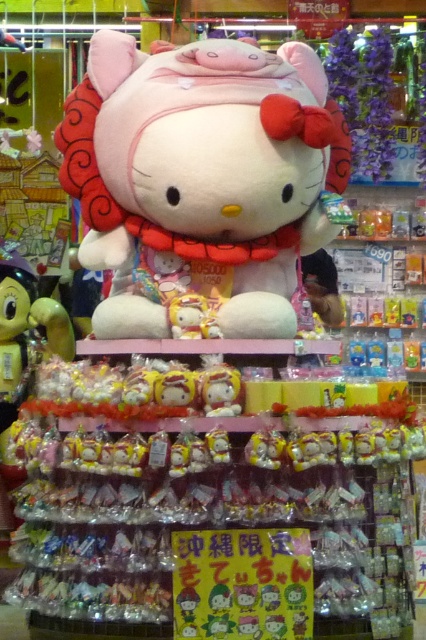
You are a customer in the store looking at the Hello Kitty display. You want to know where the point with coordinates (199,179) is located. According to the scene, which object is this point located on?

The point with coordinates (199,179) is located on the fluffy pink plush at center.

You are a customer at the store and want to pick up the fluffy pink plush at center and the matte yellow plush toy at center. Which one do you need to reach further to get?

The matte yellow plush toy at center requires reaching further because it is positioned farther from the viewer compared to the fluffy pink plush at center.

You are a customer in the store and want to pick up both the fluffy pink plush at center and the matte yellow plush toy at center. Can you reach both items at the same time if your arms are 1 meter apart?

The fluffy pink plush at center and the matte yellow plush toy at center are 85.03 centimeters apart from each other. Since your arms can reach 1 meter apart, you can reach both items at the same time.